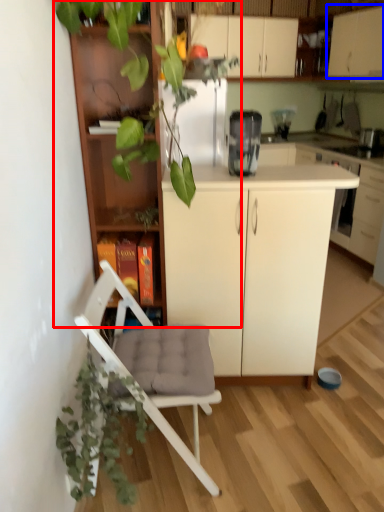
Question: Which point is further to the camera, houseplant (highlighted by a red box) or cabinetry (highlighted by a blue box)?

Choices:
 (A) houseplant
 (B) cabinetry

Answer: (B)